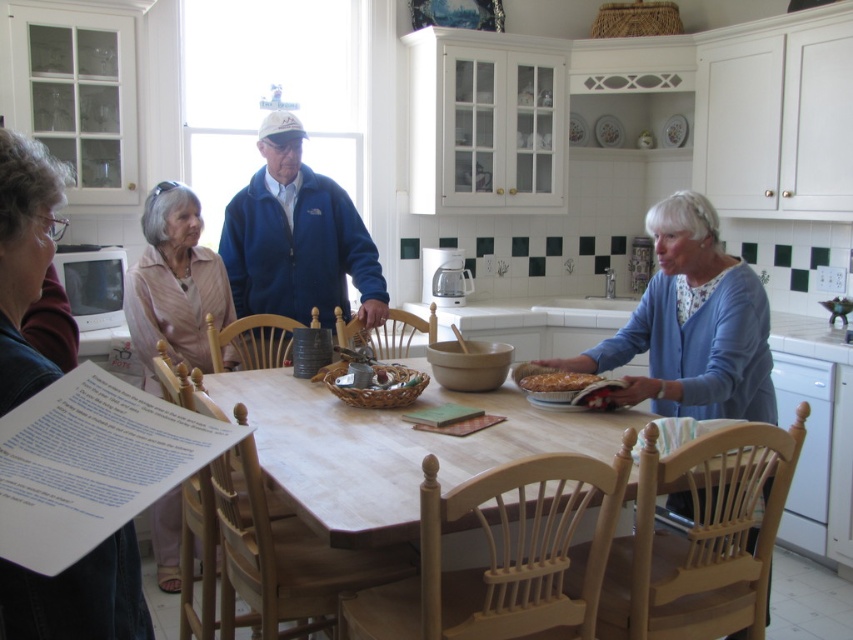
What do you see at coordinates (387, 449) in the screenshot? The height and width of the screenshot is (640, 853). I see `light brown wooden table at center` at bounding box center [387, 449].

Is light brown wooden table at center to the right of golden flaky pastry at center from the viewer's perspective?

Incorrect, light brown wooden table at center is not on the right side of golden flaky pastry at center.

Between point (329, 499) and point (572, 372), which one is positioned in front?

Positioned in front is point (329, 499).

Locate an element on the screen. The height and width of the screenshot is (640, 853). light brown wooden table at center is located at coordinates (387, 449).

Is blue cotton sweater at center smaller than golden flaky pastry at center?

Incorrect, blue cotton sweater at center is not smaller in size than golden flaky pastry at center.

Which is in front, point (718, 352) or point (552, 374)?

Point (718, 352) is in front.

Locate an element on the screen. blue cotton sweater at center is located at coordinates (692, 324).

Is point (22, 156) in front of point (561, 380)?

Yes, point (22, 156) is closer to viewer.

Between gray hair at upper left and golden flaky pastry at center, which one is positioned higher?

gray hair at upper left is above.

The image size is (853, 640). What do you see at coordinates (24, 259) in the screenshot?
I see `gray hair at upper left` at bounding box center [24, 259].

Locate an element on the screen. gray hair at upper left is located at coordinates (24, 259).